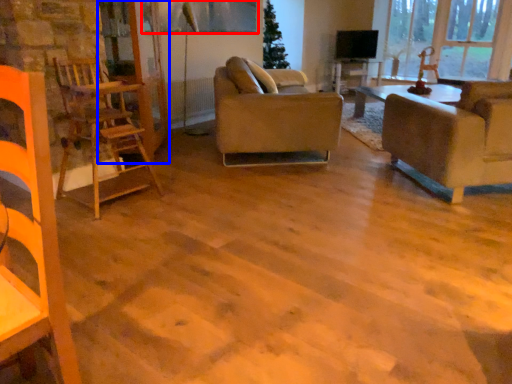
Question: Which of the following is the farthest to the observer, window screen (highlighted by a red box) or glass door (highlighted by a blue box)?

Choices:
 (A) window screen
 (B) glass door

Answer: (A)